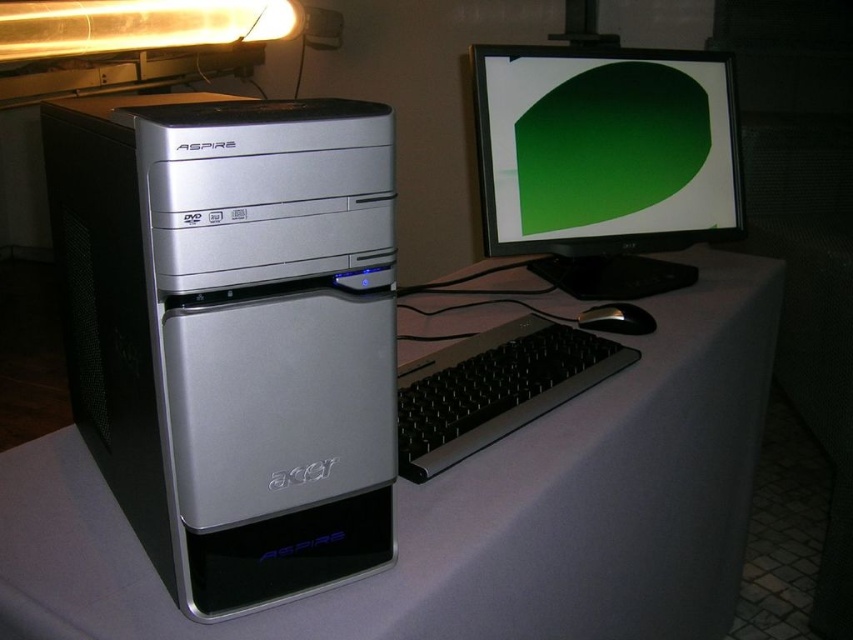
Question: Which object is the farthest from the silver metallic computer tower at left?

Choices:
 (A) white matte computer desk at center
 (B) black plastic keyboard at center
 (C) matte black monitor at upper right
 (D) black plastic mouse at lower right

Answer: (C)

Question: Estimate the real-world distances between objects in this image. Which object is farther from the silver metallic computer tower at left?

Choices:
 (A) black plastic keyboard at center
 (B) matte black monitor at upper right

Answer: (B)

Question: Can you confirm if white matte computer desk at center is positioned below black plastic mouse at lower right?

Choices:
 (A) yes
 (B) no

Answer: (A)

Question: Can you confirm if white matte computer desk at center is positioned to the right of black plastic mouse at lower right?

Choices:
 (A) yes
 (B) no

Answer: (B)

Question: Can you confirm if white matte computer desk at center is positioned above black plastic mouse at lower right?

Choices:
 (A) yes
 (B) no

Answer: (B)

Question: Which point is farther to the camera?

Choices:
 (A) (161, 573)
 (B) (604, 320)

Answer: (B)